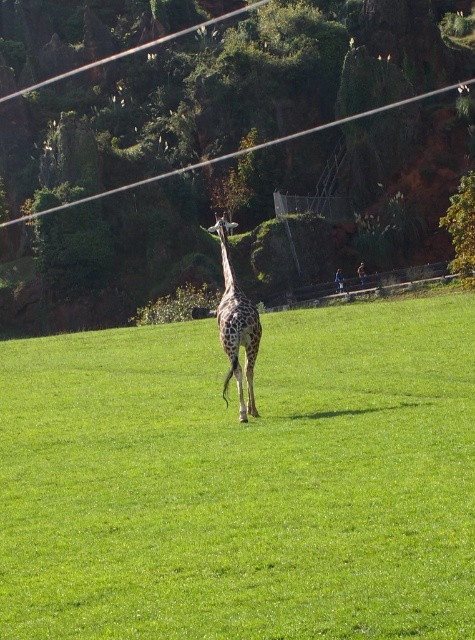
Question: Which point appears farthest from the camera in this image?

Choices:
 (A) (352, 116)
 (B) (457, 236)
 (C) (132, 541)

Answer: (A)

Question: Does transparent plastic power line at upper center appear under green leafy tree at upper center?

Choices:
 (A) yes
 (B) no

Answer: (B)

Question: Among these objects, which one is nearest to the camera?

Choices:
 (A) green leafy tree at upper center
 (B) green grass at center
 (C) transparent plastic power line at upper center

Answer: (B)

Question: Considering the relative positions of spotted fur giraffe at center and green leafy tree at upper center in the image provided, where is spotted fur giraffe at center located with respect to green leafy tree at upper center?

Choices:
 (A) above
 (B) below

Answer: (B)

Question: Is spotted fur giraffe at center wider than transparent plastic power line at upper center?

Choices:
 (A) yes
 (B) no

Answer: (B)

Question: Based on their relative distances, which object is farther from the green leafy tree at upper center?

Choices:
 (A) spotted fur giraffe at center
 (B) transparent plastic power line at upper center

Answer: (A)